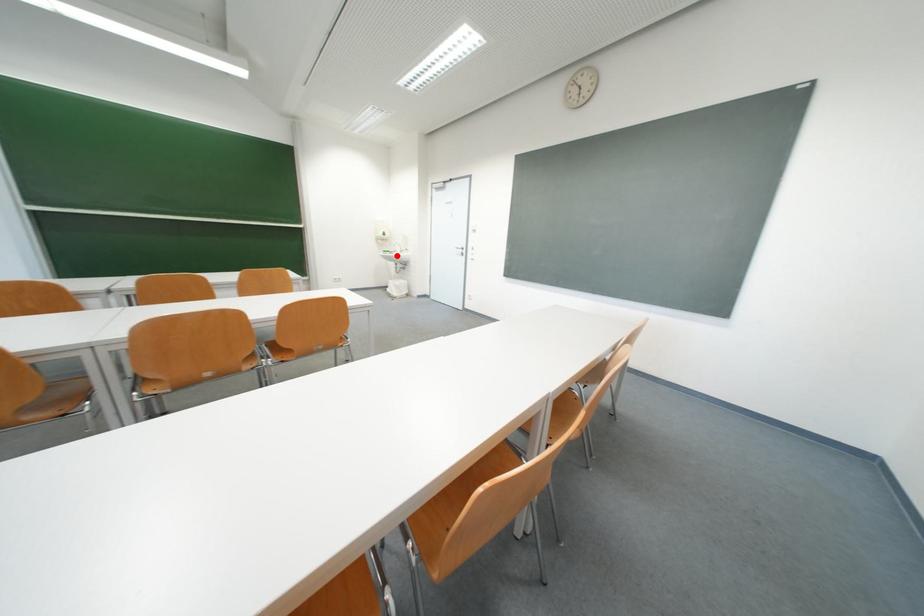
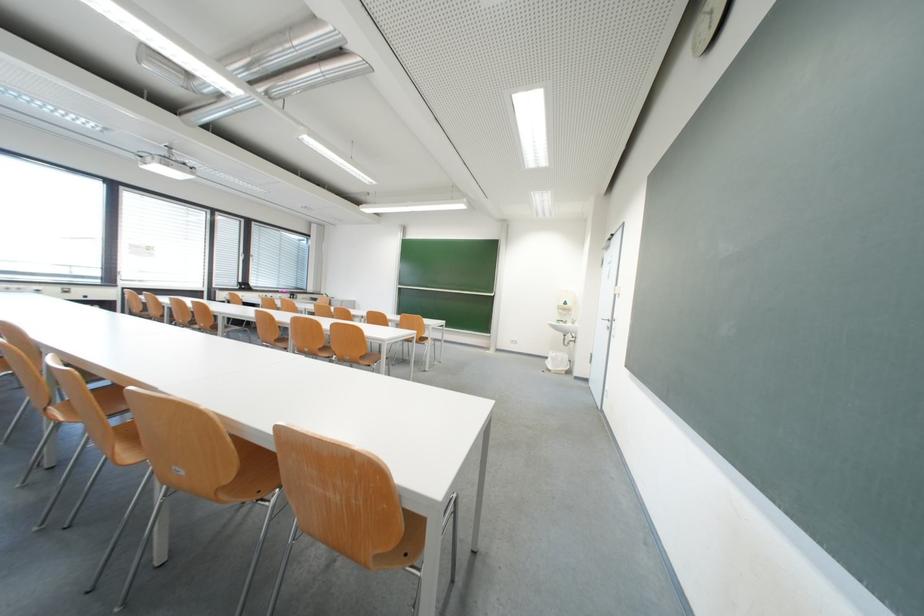
Question: I am providing you with two images of the same scene from different viewpoints. In image1, a red point is highlighted. Considering the same 3D point in image2, which of the following is correct?

Choices:
 (A) It is closer
 (B) It is farther

Answer: (B)